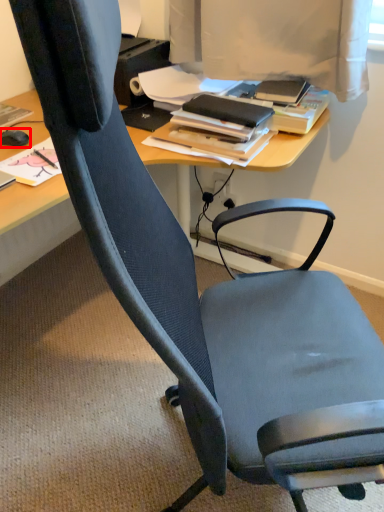
Question: From the image's perspective, where is mouse (annotated by the red box) located in relation to book in the image?

Choices:
 (A) below
 (B) above

Answer: (A)